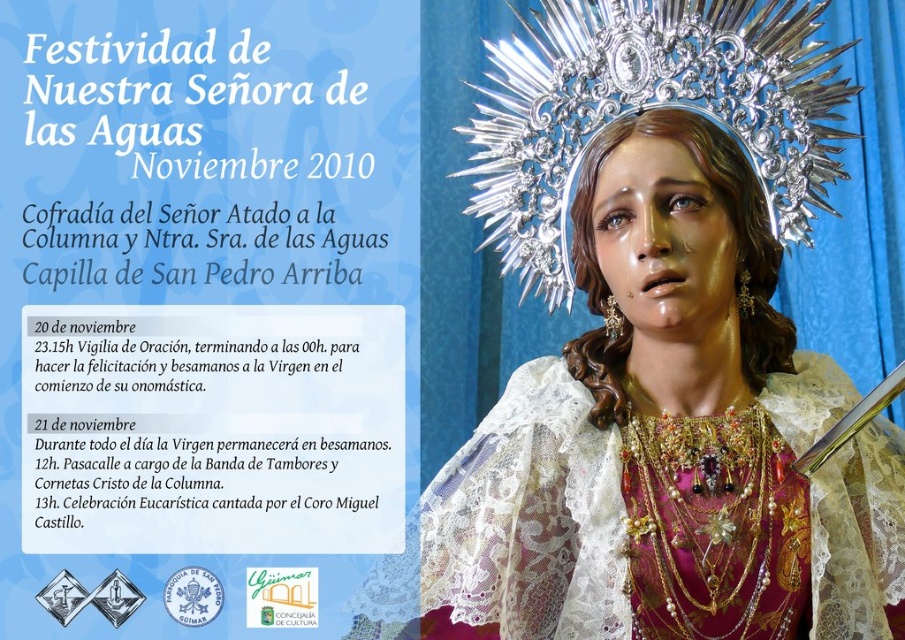
You are designing a digital banner for the festival and need to place the white paper at upper left and the silver metallic crown at upper center. Given that the banner has a width constraint of 300 pixels, can both elements fit side by side without overlapping?

The white paper at upper left is wider than the silver metallic crown at upper center. However, since the banner has a width constraint of 300 pixels, their combined widths must be less than or equal to 300 pixels. Without knowing their exact dimensions, it is impossible to determine if they can fit side by side without overlapping.

You are a festival attendee holding a 2.5 meter long banner. You want to place it between the white paper at upper left and the religious figure. Will the banner fit in the space between them?

The distance between the white paper at upper left and the religious figure is 3.07 meters. Since the banner is 2.5 meters long, it will fit in the space between them as it is shorter than the available distance.

You are designing a poster and need to place a new element at coordinate point 0.5, 0.2. Is there already an object at white paper at upper left near that location?

The white paper at upper left is located at point (205, 310), which is very close to the desired coordinate (181, 320). Therefore, placing a new element there may overlap with the existing white paper at upper left.